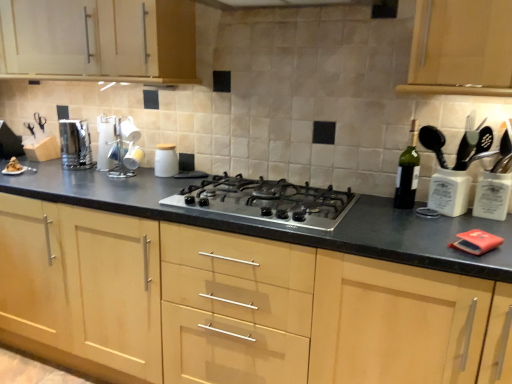
You are a GUI agent. You are given a task and a screenshot of the screen. Output one action in this format:
    pyautogui.click(x=<x>, y=<y>)
    Task: Click on the free space behind green glass bottle at right
    The width and height of the screenshot is (512, 384).
    Given the screenshot: What is the action you would take?
    pyautogui.click(x=385, y=198)